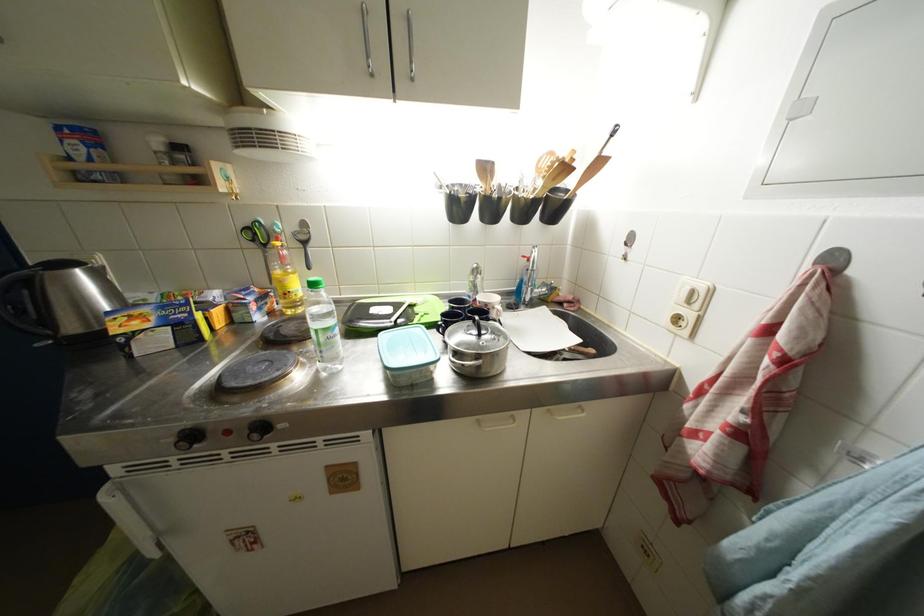
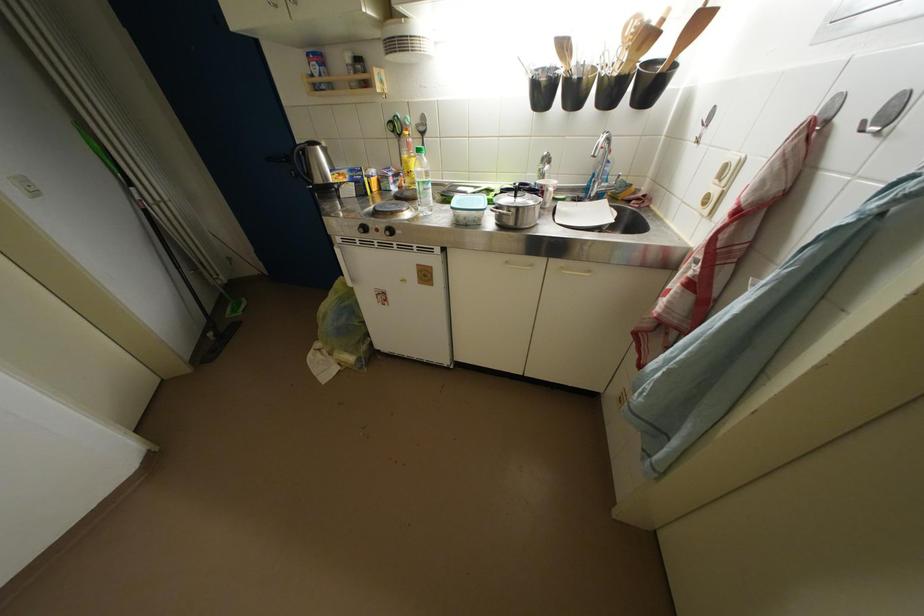
In the second image, find the point that corresponds to point (393, 371) in the first image.

(458, 212)